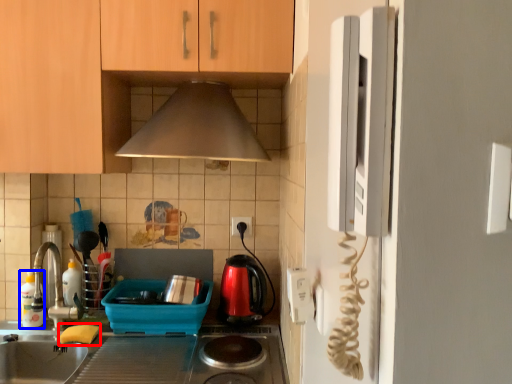
Question: Which of the following is the closest to the observer, food (highlighted by a red box) or bottle (highlighted by a blue box)?

Choices:
 (A) food
 (B) bottle

Answer: (A)